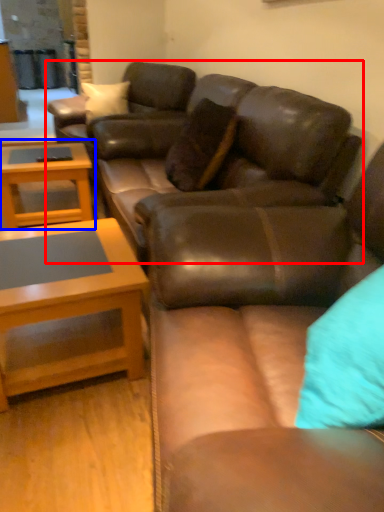
Question: Among these objects, which one is nearest to the camera, studio couch (highlighted by a red box) or coffee table (highlighted by a blue box)?

Choices:
 (A) studio couch
 (B) coffee table

Answer: (A)